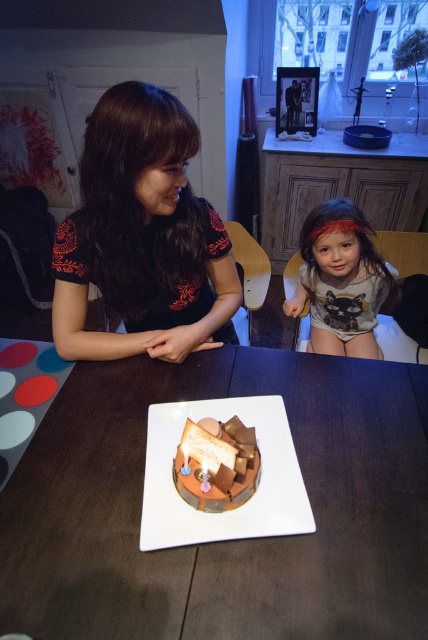
Question: Among these objects, which one is nearest to the camera?

Choices:
 (A) matte black dress at upper left
 (B) smooth wooden table at center
 (C) gray cotton shirt at center

Answer: (B)

Question: Considering the relative positions of smooth wooden table at center and matte black dress at upper left in the image provided, where is smooth wooden table at center located with respect to matte black dress at upper left?

Choices:
 (A) below
 (B) above

Answer: (A)

Question: Which of the following is the closest to the observer?

Choices:
 (A) gray cotton shirt at center
 (B) smooth wooden table at center
 (C) matte black dress at upper left

Answer: (B)

Question: Which point is farther to the camera?

Choices:
 (A) smooth wooden table at center
 (B) chocolatesmoothcake at center
 (C) gray cotton shirt at center
 (D) matte black dress at upper left

Answer: (C)

Question: Considering the relative positions of smooth wooden table at center and chocolatesmoothcake at center in the image provided, where is smooth wooden table at center located with respect to chocolatesmoothcake at center?

Choices:
 (A) right
 (B) left

Answer: (A)

Question: Does smooth wooden table at center appear over gray cotton shirt at center?

Choices:
 (A) no
 (B) yes

Answer: (A)